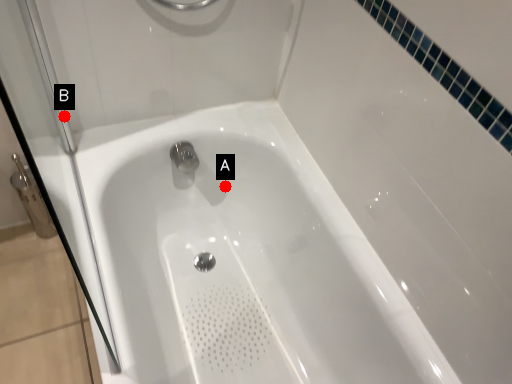
Question: Two points are circled on the image, labeled by A and B beside each circle. Which point is further to the camera?

Choices:
 (A) A is further
 (B) B is further

Answer: (A)